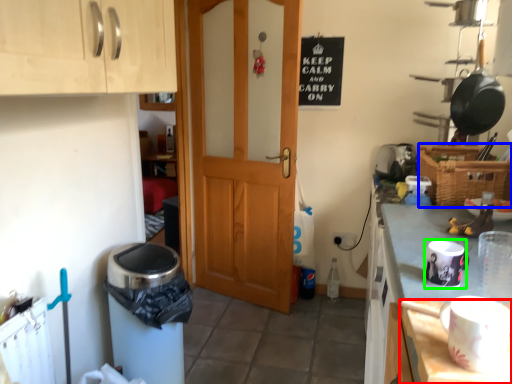
Question: Which is nearer to the table (highlighted by a red box)? basket (highlighted by a blue box) or appliance (highlighted by a green box).

Choices:
 (A) basket
 (B) appliance

Answer: (B)